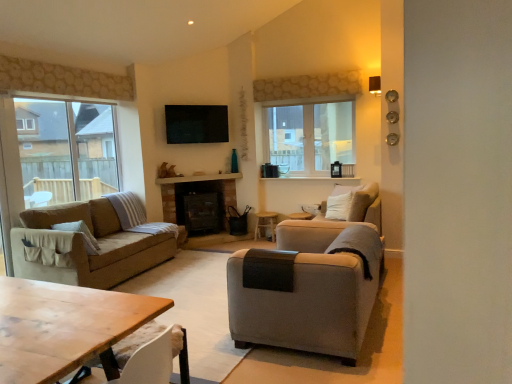
Question: Should I look upward or downward to see light gray fabric armchair at right?

Choices:
 (A) up
 (B) down

Answer: (B)

Question: Is transparent glass screen door at left bigger than clear glass window at left, acting as the first window starting from the front?

Choices:
 (A) no
 (B) yes

Answer: (A)

Question: Is transparent glass screen door at left closer to the viewer compared to clear glass window at left, positioned as the first window in left-to-right order?

Choices:
 (A) yes
 (B) no

Answer: (A)

Question: Is transparent glass screen door at left outside of clear glass window at left, placed as the 2th window when sorted from right to left?

Choices:
 (A) no
 (B) yes

Answer: (B)

Question: Can you confirm if transparent glass screen door at left is positioned to the left of clear glass window at left, the second window positioned from the back?

Choices:
 (A) no
 (B) yes

Answer: (B)

Question: Are transparent glass screen door at left and clear glass window at left, positioned as the first window in left-to-right order, far apart?

Choices:
 (A) yes
 (B) no

Answer: (A)

Question: Is transparent glass screen door at left thinner than clear glass window at left, the second window positioned from the back?

Choices:
 (A) no
 (B) yes

Answer: (B)

Question: From the image's perspective, is clear glass window at left, acting as the first window starting from the front, located above clear glass window at center, the 2th window positioned from the left?

Choices:
 (A) no
 (B) yes

Answer: (A)

Question: Is clear glass window at left, acting as the first window starting from the front, positioned with its back to clear glass window at center, the 2th window positioned from the left?

Choices:
 (A) no
 (B) yes

Answer: (A)

Question: Is clear glass window at left, acting as the first window starting from the front, to the right of clear glass window at center, acting as the 1th window starting from the right, from the viewer's perspective?

Choices:
 (A) no
 (B) yes

Answer: (A)

Question: From a real-world perspective, is clear glass window at left, placed as the 2th window when sorted from right to left, positioned under clear glass window at center, acting as the 1th window starting from the right, based on gravity?

Choices:
 (A) no
 (B) yes

Answer: (B)

Question: Would you consider clear glass window at left, acting as the first window starting from the front, to be distant from clear glass window at center, which is the first window from back to front?

Choices:
 (A) no
 (B) yes

Answer: (B)

Question: Does clear glass window at left, the second window positioned from the back, have a lesser height compared to clear glass window at center, which is the first window from back to front?

Choices:
 (A) yes
 (B) no

Answer: (B)

Question: Is transparent glass screen door at left not inside wooden table at lower left?

Choices:
 (A) no
 (B) yes

Answer: (B)